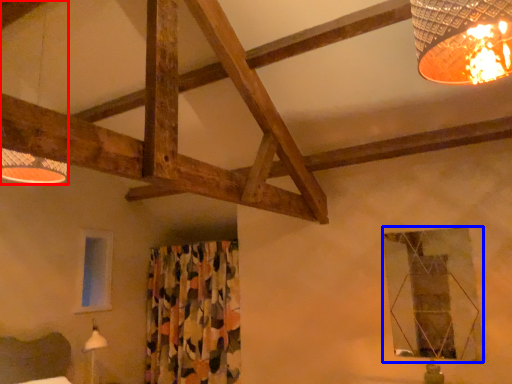
Question: Which point is further to the camera, lamp (highlighted by a red box) or window (highlighted by a blue box)?

Choices:
 (A) lamp
 (B) window

Answer: (B)